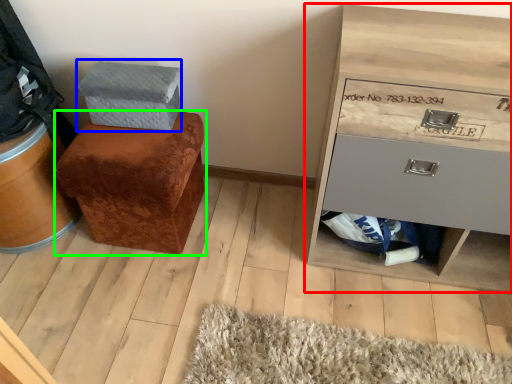
Question: Which is farther away from chest of drawers (highlighted by a red box)? shoe box (highlighted by a blue box) or furniture (highlighted by a green box)?

Choices:
 (A) shoe box
 (B) furniture

Answer: (A)